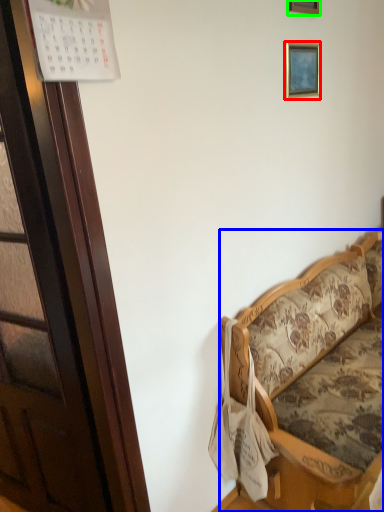
Question: Which object is the farthest from picture frame (highlighted by a red box)? Choose among these: studio couch (highlighted by a blue box) or picture frame (highlighted by a green box).

Choices:
 (A) studio couch
 (B) picture frame

Answer: (A)